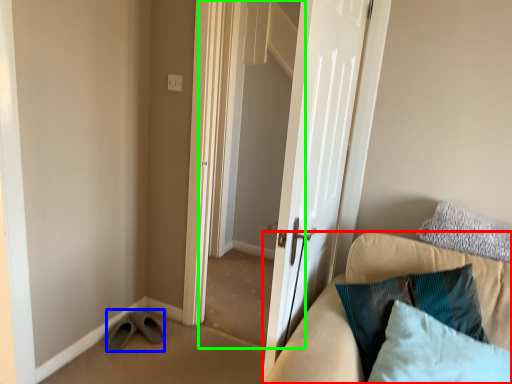
Question: Which object is the farthest from studio couch (highlighted by a red box)? Choose among these: shoe (highlighted by a blue box) or screen door (highlighted by a green box).

Choices:
 (A) shoe
 (B) screen door

Answer: (B)